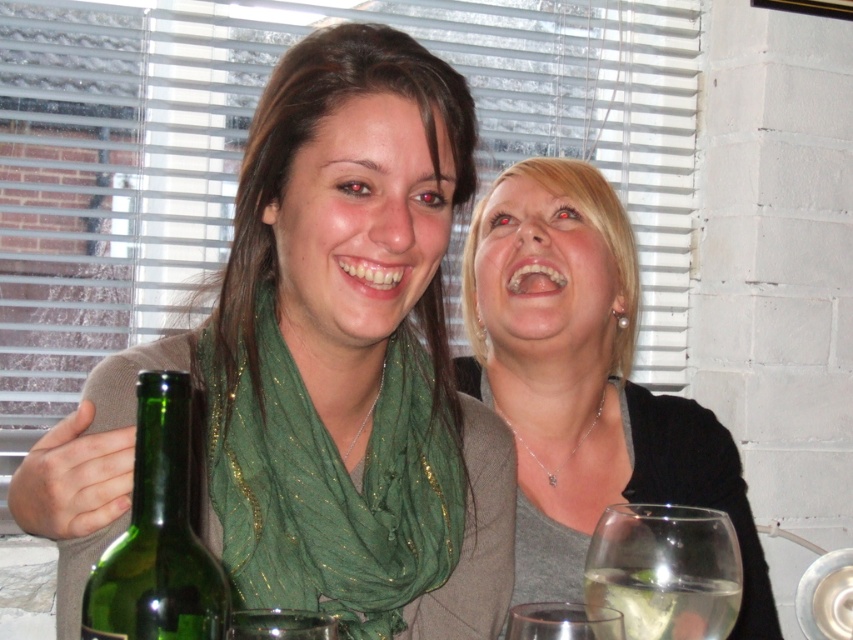
Question: Which point appears farthest from the camera in this image?

Choices:
 (A) (627, 513)
 (B) (245, 188)

Answer: (B)

Question: Where is green glass bottle at left located in relation to clear glass wine glass at lower right in the image?

Choices:
 (A) above
 (B) below

Answer: (A)

Question: Which of these objects is positioned closest to the clear glass wine glass at lower right?

Choices:
 (A) green shimmering scarf at center
 (B) green sheer scarf at center
 (C) matte black top at center
 (D) green glass bottle at left

Answer: (A)

Question: Does green sheer scarf at center appear over matte black top at center?

Choices:
 (A) no
 (B) yes

Answer: (B)

Question: Considering the relative positions of green sheer scarf at center and green shimmering scarf at center in the image provided, where is green sheer scarf at center located with respect to green shimmering scarf at center?

Choices:
 (A) left
 (B) right

Answer: (B)

Question: Which of the following is the farthest from the observer?

Choices:
 (A) matte black top at center
 (B) green shimmering scarf at center
 (C) green glass bottle at left

Answer: (A)